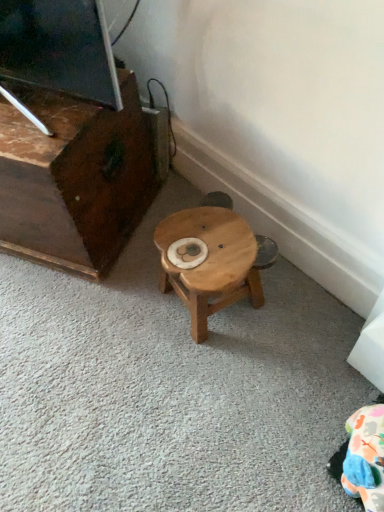
Question: Does wooden stool at center appear on the left side of dark brown wood entertainment center at left?

Choices:
 (A) yes
 (B) no

Answer: (B)

Question: Considering the relative positions of wooden stool at center and dark brown wood entertainment center at left in the image provided, is wooden stool at center in front of dark brown wood entertainment center at left?

Choices:
 (A) yes
 (B) no

Answer: (B)

Question: Does wooden stool at center have a smaller size compared to dark brown wood entertainment center at left?

Choices:
 (A) no
 (B) yes

Answer: (B)

Question: Could you tell me if wooden stool at center is turned towards dark brown wood entertainment center at left?

Choices:
 (A) no
 (B) yes

Answer: (A)

Question: From a real-world perspective, is wooden stool at center physically below dark brown wood entertainment center at left?

Choices:
 (A) no
 (B) yes

Answer: (B)

Question: From the image's perspective, would you say wooden stool at center is positioned over dark brown wood entertainment center at left?

Choices:
 (A) no
 (B) yes

Answer: (A)

Question: Is dark brown wood entertainment center at left not close to wooden stool at center?

Choices:
 (A) yes
 (B) no

Answer: (B)

Question: Is dark brown wood entertainment center at left to the right of wooden stool at center from the viewer's perspective?

Choices:
 (A) no
 (B) yes

Answer: (A)

Question: Does dark brown wood entertainment center at left have a greater width compared to wooden stool at center?

Choices:
 (A) yes
 (B) no

Answer: (A)

Question: From the image's perspective, is dark brown wood entertainment center at left located above wooden stool at center?

Choices:
 (A) yes
 (B) no

Answer: (A)

Question: From the image's perspective, is dark brown wood entertainment center at left beneath wooden stool at center?

Choices:
 (A) no
 (B) yes

Answer: (A)

Question: From a real-world perspective, is dark brown wood entertainment center at left below wooden stool at center?

Choices:
 (A) no
 (B) yes

Answer: (A)

Question: Looking at their shapes, would you say dark brown wood entertainment center at left is wider or thinner than wooden stool at center?

Choices:
 (A) wide
 (B) thin

Answer: (A)